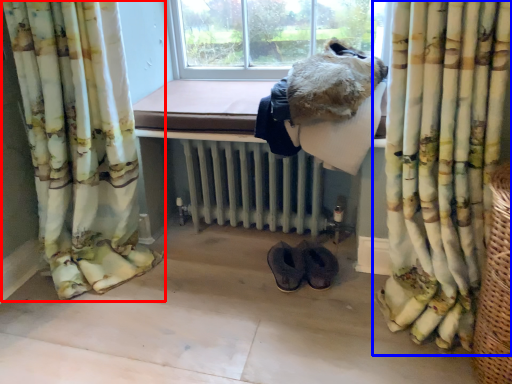
Question: Which of the following is the farthest to the observer, curtain (highlighted by a red box) or curtain (highlighted by a blue box)?

Choices:
 (A) curtain
 (B) curtain

Answer: (A)